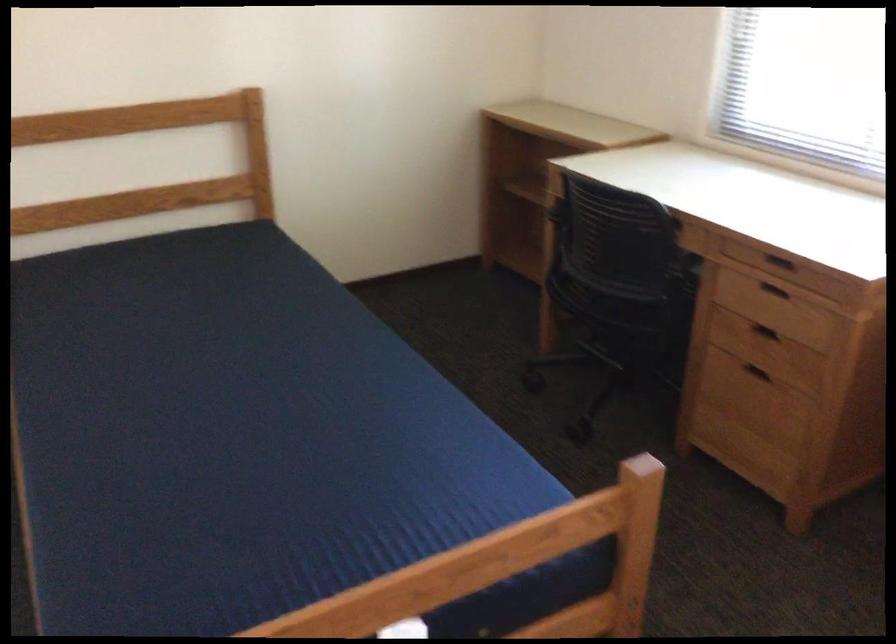
The height and width of the screenshot is (644, 896). Describe the element at coordinates (622, 299) in the screenshot. I see `the black chair sitting surface` at that location.